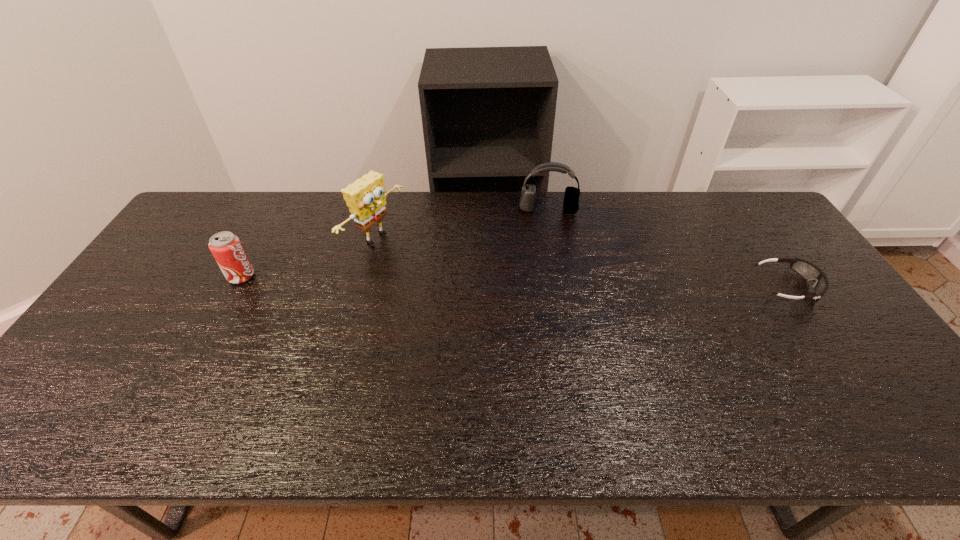
Locate an element on the screen. vacant area at the right edge of the desktop is located at coordinates (878, 354).

I want to click on free space at the far right corner of the desktop, so click(x=747, y=222).

Image resolution: width=960 pixels, height=540 pixels. I want to click on vacant space in between the second shortest object and the goggles, so click(514, 281).

Where is `free space between the third tallest object and the third object from right to left`? This screenshot has height=540, width=960. free space between the third tallest object and the third object from right to left is located at coordinates (308, 257).

This screenshot has height=540, width=960. In order to click on free space between the leftmost object and the third object from left to right in this screenshot , I will do `click(395, 243)`.

Where is `free space between the soda can and the second object from left to right`? The width and height of the screenshot is (960, 540). free space between the soda can and the second object from left to right is located at coordinates (308, 257).

Locate an element on the screen. The image size is (960, 540). empty location between the rightmost object and the third tallest object is located at coordinates (514, 281).

What are the coordinates of `free point between the sponge and the third shortest object` in the screenshot? It's located at pos(462,224).

The width and height of the screenshot is (960, 540). I want to click on free space that is in between the leftmost object and the headset, so (395, 243).

Find the location of a particular element. The height and width of the screenshot is (540, 960). empty space that is in between the third object from right to left and the goggles is located at coordinates (581, 262).